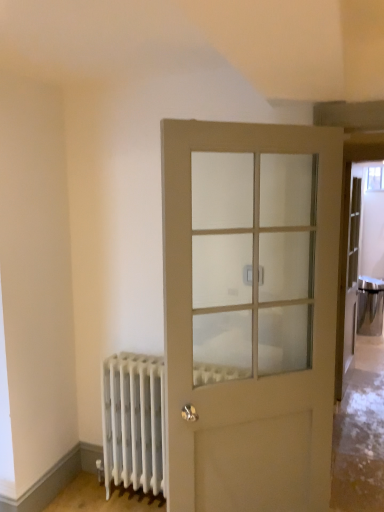
Question: Considering the relative sizes of matte white door at center and satin silver door handle at center in the image provided, is matte white door at center wider than satin silver door handle at center?

Choices:
 (A) no
 (B) yes

Answer: (B)

Question: Is matte white door at center not inside satin silver door handle at center?

Choices:
 (A) yes
 (B) no

Answer: (A)

Question: Considering the relative positions of matte white door at center and satin silver door handle at center in the image provided, is matte white door at center to the right of satin silver door handle at center from the viewer's perspective?

Choices:
 (A) yes
 (B) no

Answer: (B)

Question: From a real-world perspective, is matte white door at center positioned under satin silver door handle at center based on gravity?

Choices:
 (A) yes
 (B) no

Answer: (A)

Question: Is matte white door at center in contact with satin silver door handle at center?

Choices:
 (A) yes
 (B) no

Answer: (B)

Question: Is satin silver door handle at center bigger or smaller than matte white door at center?

Choices:
 (A) small
 (B) big

Answer: (A)

Question: Do you think satin silver door handle at center is within matte white door at center, or outside of it?

Choices:
 (A) outside
 (B) inside

Answer: (A)

Question: Considering the positions of point (259, 285) and point (274, 459), is point (259, 285) closer or farther from the camera than point (274, 459)?

Choices:
 (A) farther
 (B) closer

Answer: (A)

Question: Is satin silver door handle at center to the left or to the right of matte white door at center in the image?

Choices:
 (A) left
 (B) right

Answer: (B)

Question: Does point (258, 276) appear closer or farther from the camera than point (135, 373)?

Choices:
 (A) farther
 (B) closer

Answer: (B)

Question: Is satin silver door handle at center taller or shorter than white matte radiator at lower left?

Choices:
 (A) short
 (B) tall

Answer: (A)

Question: From a real-world perspective, is satin silver door handle at center above or below white matte radiator at lower left?

Choices:
 (A) below
 (B) above

Answer: (B)

Question: Considering the positions of satin silver door handle at center and white matte radiator at lower left in the image, is satin silver door handle at center bigger or smaller than white matte radiator at lower left?

Choices:
 (A) small
 (B) big

Answer: (A)

Question: In the image, is white matte radiator at lower left on the left side or the right side of satin silver door handle at center?

Choices:
 (A) right
 (B) left

Answer: (B)

Question: From a real-world perspective, relative to satin silver door handle at center, is white matte radiator at lower left vertically above or below?

Choices:
 (A) below
 (B) above

Answer: (A)